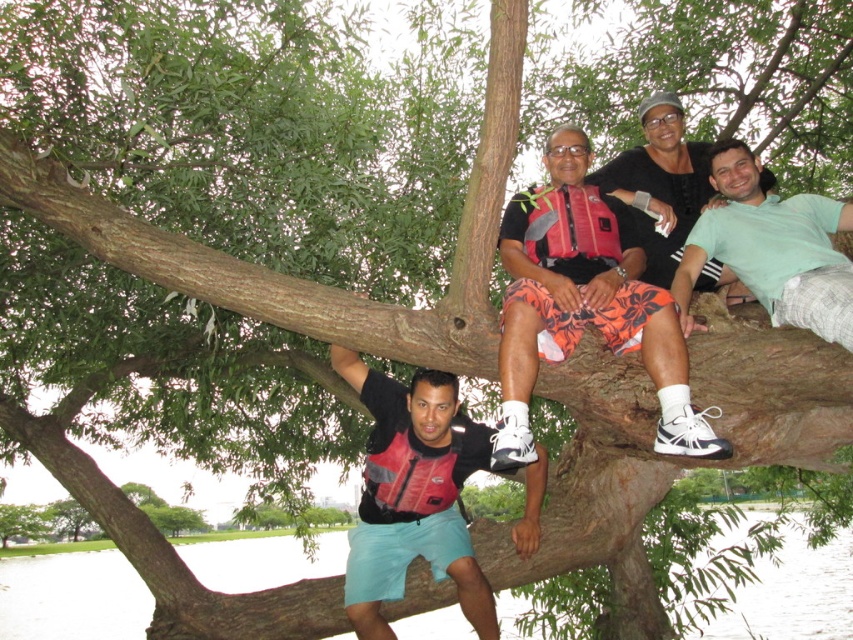
Question: Does smooth water at lower left appear on the left side of matte red life vest at center?

Choices:
 (A) no
 (B) yes

Answer: (A)

Question: Is floral shorts at center smaller than matte red life vest at center?

Choices:
 (A) no
 (B) yes

Answer: (A)

Question: Which object appears closest to the camera in this image?

Choices:
 (A) green cotton shirt at upper right
 (B) matte red life vest at center
 (C) smooth water at lower left

Answer: (A)

Question: Among these points, which one is nearest to the camera?

Choices:
 (A) (531, 240)
 (B) (482, 461)
 (C) (815, 241)

Answer: (C)

Question: Which object appears farthest from the camera in this image?

Choices:
 (A) smooth water at lower left
 (B) matte red life vest at center
 (C) floral shorts at center

Answer: (A)

Question: Is smooth water at lower left in front of matte red life vest at center?

Choices:
 (A) yes
 (B) no

Answer: (B)